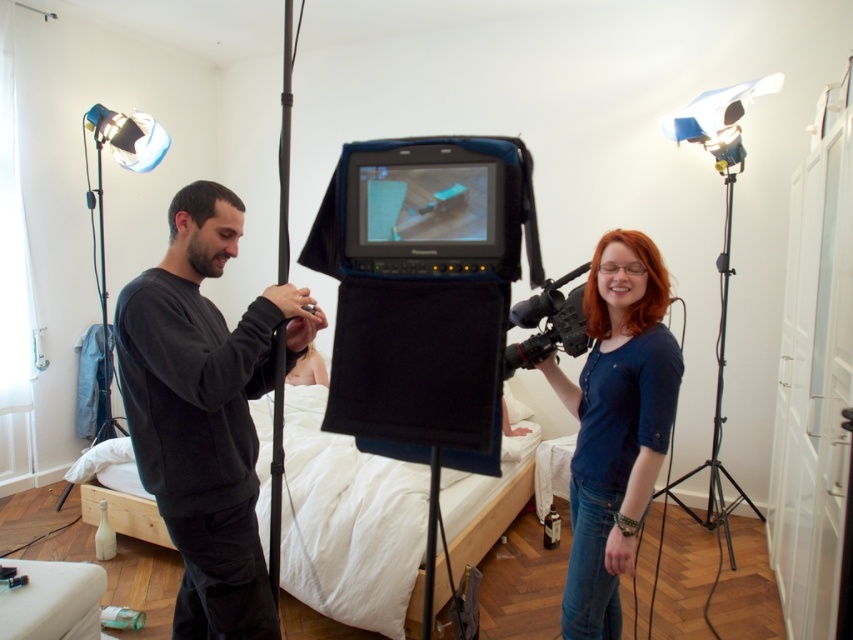
Question: Estimate the real-world distances between objects in this image. Which object is closer to the blue cotton shirt at right?

Choices:
 (A) black matte sweatshirt at center
 (B) black metal tripod at right
 (C) white fabric bed at center
 (D) matte black camera at center

Answer: (D)

Question: Which point is closer to the camera?

Choices:
 (A) (538, 355)
 (B) (519, 404)
 (C) (225, 508)

Answer: (C)

Question: From the image, what is the correct spatial relationship of black metal tripod at right in relation to matte black camera at center?

Choices:
 (A) right
 (B) left

Answer: (A)

Question: Which point is farther to the camera?

Choices:
 (A) black metal tripod at right
 (B) blue cotton shirt at right
 (C) matte black camera at center
 (D) black matte sweatshirt at center

Answer: (A)

Question: Does black matte sweatshirt at center appear on the left side of matte black camera at center?

Choices:
 (A) no
 (B) yes

Answer: (B)

Question: Can you confirm if black matte sweatshirt at center is positioned above matte black camera at center?

Choices:
 (A) no
 (B) yes

Answer: (A)